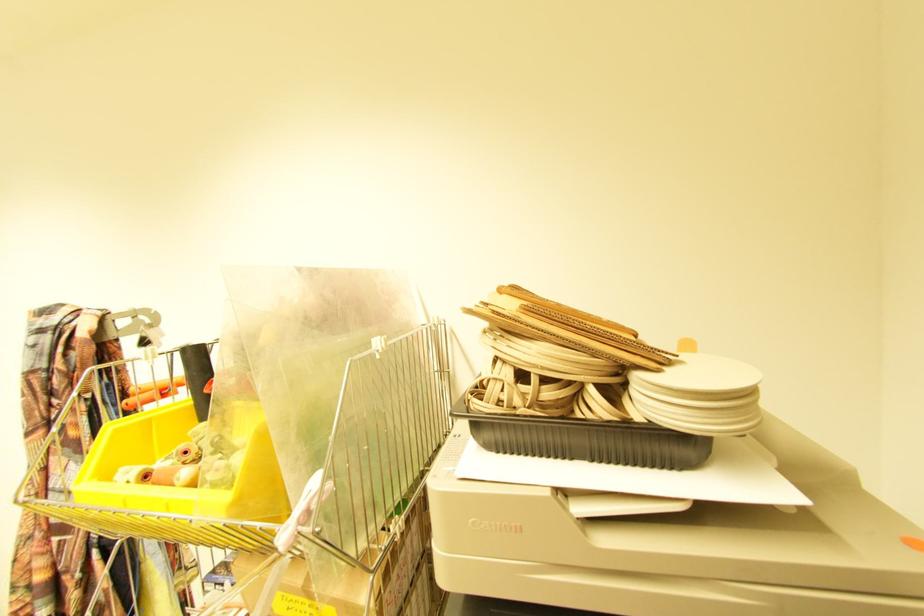
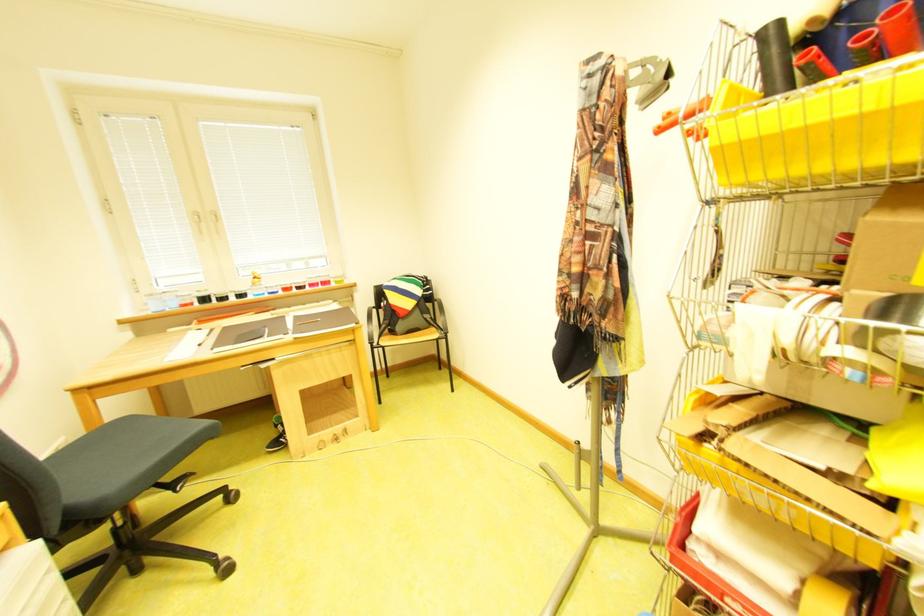
Question: The camera is either moving clockwise (left) or counter-clockwise (right) around the object. The first image is from the beginning of the video and the second image is from the end. Is the camera moving left or right when shooting the video?

Choices:
 (A) Left
 (B) Right

Answer: (B)